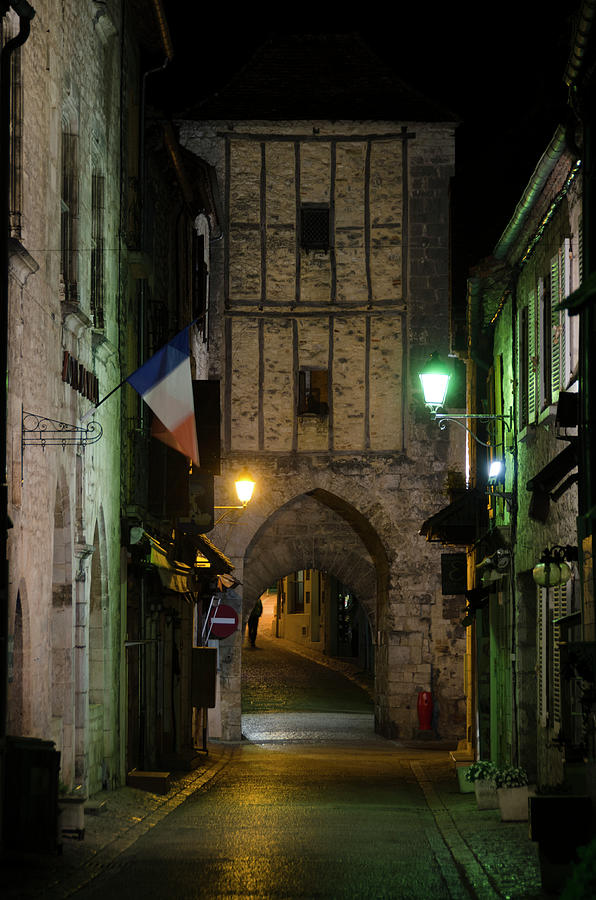
I want to click on green light, so click(431, 392).